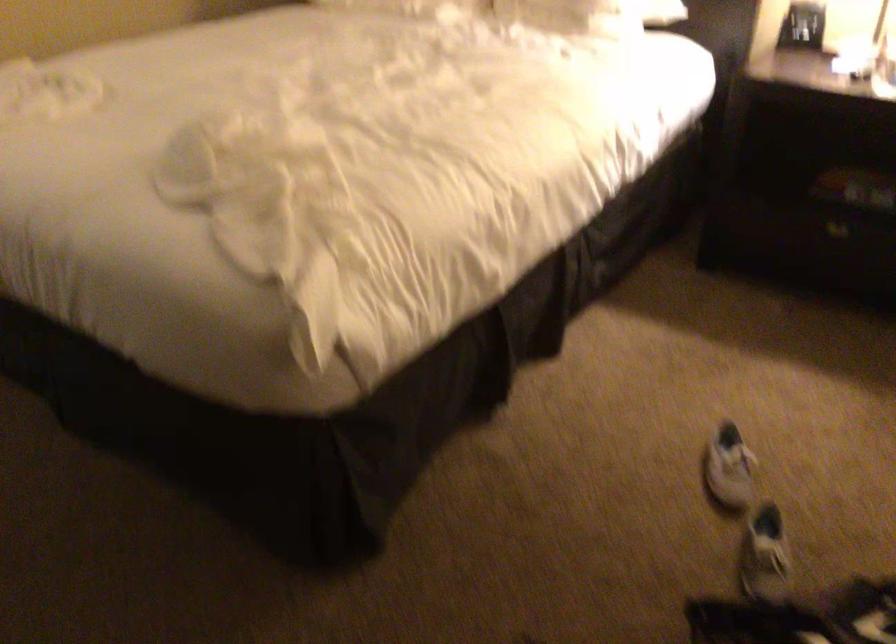
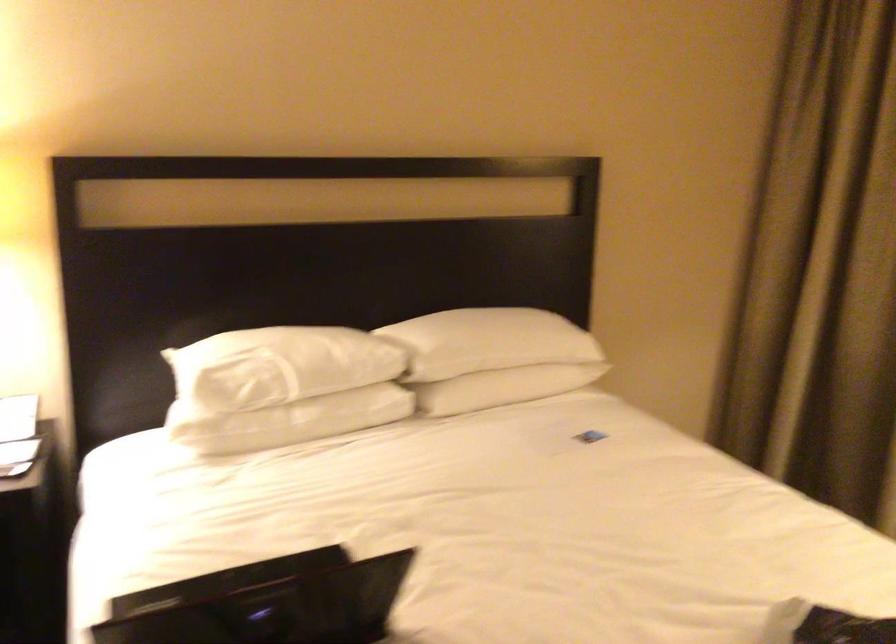
Question: The camera is either moving clockwise (left) or counter-clockwise (right) around the object. The first image is from the beginning of the video and the second image is from the end. Is the camera moving left or right when shooting the video?

Choices:
 (A) Left
 (B) Right

Answer: (A)